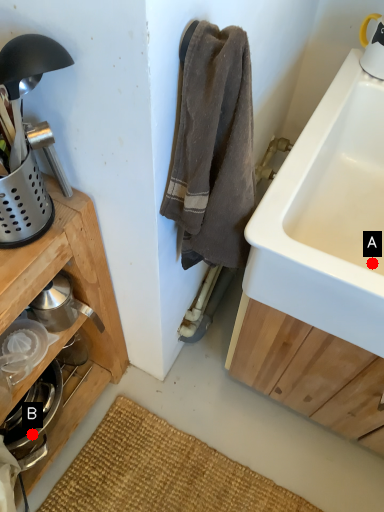
Question: Two points are circled on the image, labeled by A and B beside each circle. Which point is further to the camera?

Choices:
 (A) A is further
 (B) B is further

Answer: (B)